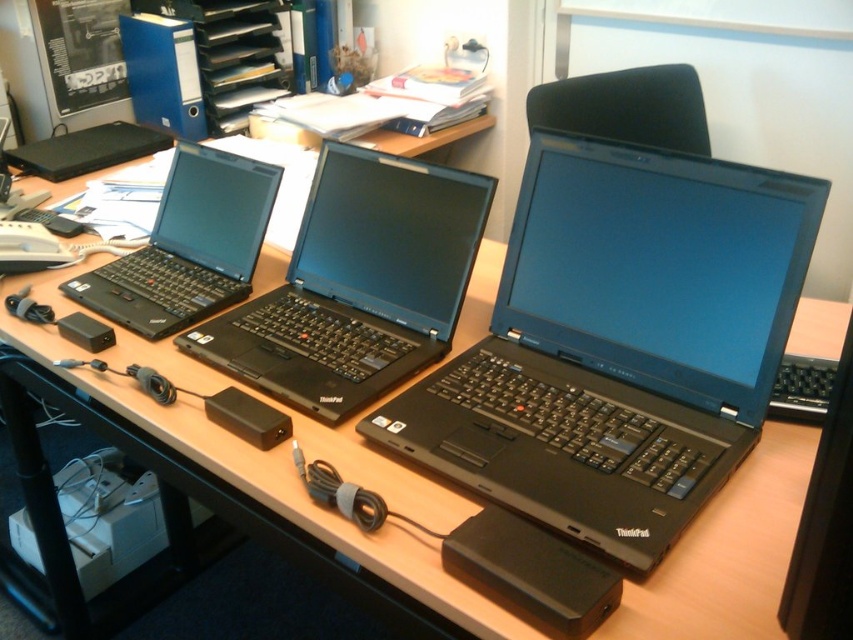
In the scene shown: Is matte black laptop at center to the left of black matte laptop at left from the viewer's perspective?

Incorrect, matte black laptop at center is not on the left side of black matte laptop at left.

Where is `matte black laptop at center`? The width and height of the screenshot is (853, 640). matte black laptop at center is located at coordinates (619, 342).

Does point (375, 394) lie behind point (204, 280)?

That is False.

Who is lower down, black matte laptop at center or black matte laptop at left?

black matte laptop at center

Is point (293, 253) behind point (187, 285)?

That is False.

At what (x,y) coordinates should I click in order to perform the action: click on black matte laptop at center. Please return your answer as a coordinate pair (x, y). The image size is (853, 640). Looking at the image, I should click on (357, 284).

What do you see at coordinates (619, 342) in the screenshot?
I see `matte black laptop at center` at bounding box center [619, 342].

Can you confirm if matte black laptop at center is taller than black matte laptop at center?

Indeed, matte black laptop at center has a greater height compared to black matte laptop at center.

Which is in front, point (438, 424) or point (401, 164)?

Point (438, 424) is more forward.

Where is `matte black laptop at center`? The image size is (853, 640). matte black laptop at center is located at coordinates (619, 342).